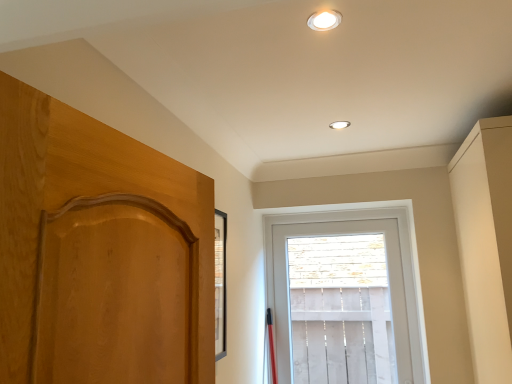
Question: Considering the relative sizes of white glossy light fixture at upper center, which ranks as the second lighting in top-to-bottom order, and matte beige dresser at right in the image provided, is white glossy light fixture at upper center, which ranks as the second lighting in top-to-bottom order, smaller than matte beige dresser at right?

Choices:
 (A) no
 (B) yes

Answer: (B)

Question: Could matte beige dresser at right be considered to be inside white glossy light fixture at upper center, which appears as the first lighting when viewed from the back?

Choices:
 (A) yes
 (B) no

Answer: (B)

Question: Is white glossy light fixture at upper center, acting as the first lighting starting from the right, positioned with its back to matte beige dresser at right?

Choices:
 (A) yes
 (B) no

Answer: (B)

Question: From a real-world perspective, is white glossy light fixture at upper center, which appears as the first lighting when viewed from the back, on top of matte beige dresser at right?

Choices:
 (A) yes
 (B) no

Answer: (A)

Question: Can you confirm if white glossy light fixture at upper center, which appears as the first lighting when ordered from the bottom, is wider than matte beige dresser at right?

Choices:
 (A) yes
 (B) no

Answer: (B)

Question: Is point (342, 125) positioned closer to the camera than point (487, 175)?

Choices:
 (A) farther
 (B) closer

Answer: (A)

Question: From their relative heights in the image, would you say white glossy light fixture at upper center, the second lighting positioned from the left, is taller or shorter than matte beige dresser at right?

Choices:
 (A) tall
 (B) short

Answer: (B)

Question: From a real-world perspective, is white glossy light fixture at upper center, which appears as the first lighting when ordered from the bottom, above or below matte beige dresser at right?

Choices:
 (A) above
 (B) below

Answer: (A)

Question: Is white glossy light fixture at upper center, which appears as the first lighting when ordered from the bottom, wider or thinner than matte beige dresser at right?

Choices:
 (A) wide
 (B) thin

Answer: (B)

Question: From a real-world perspective, is white glossy light fixture at upper center, which appears as the first lighting when ordered from the bottom, positioned above or below white glossy recessed light at upper center, arranged as the second lighting when viewed from the back?

Choices:
 (A) below
 (B) above

Answer: (A)

Question: Visually, is white glossy light fixture at upper center, acting as the first lighting starting from the right, positioned to the left or to the right of white glossy recessed light at upper center, arranged as the 1th lighting when viewed from the top?

Choices:
 (A) left
 (B) right

Answer: (B)

Question: Is point (333, 124) closer or farther from the camera than point (336, 19)?

Choices:
 (A) closer
 (B) farther

Answer: (B)

Question: Considering the positions of white glossy light fixture at upper center, the second lighting positioned from the left, and white glossy recessed light at upper center, the 1th lighting positioned from the front, in the image, is white glossy light fixture at upper center, the second lighting positioned from the left, bigger or smaller than white glossy recessed light at upper center, the 1th lighting positioned from the front,?

Choices:
 (A) small
 (B) big

Answer: (B)

Question: From a real-world perspective, is white glossy light fixture at upper center, which appears as the first lighting when ordered from the bottom, positioned above or below white wooden window at center?

Choices:
 (A) below
 (B) above

Answer: (B)

Question: Considering their positions, is white glossy light fixture at upper center, acting as the first lighting starting from the right, located in front of or behind white wooden window at center?

Choices:
 (A) front
 (B) behind

Answer: (A)